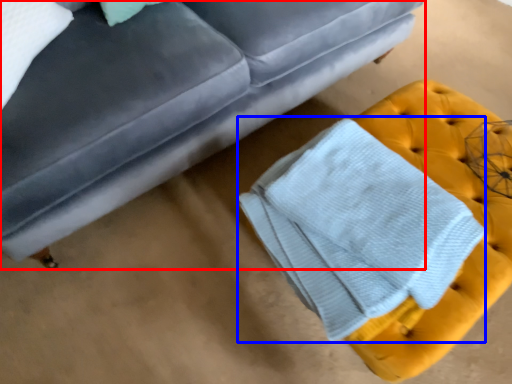
Question: Which object is closer to the camera taking this photo, studio couch (highlighted by a red box) or bath towel (highlighted by a blue box)?

Choices:
 (A) studio couch
 (B) bath towel

Answer: (A)